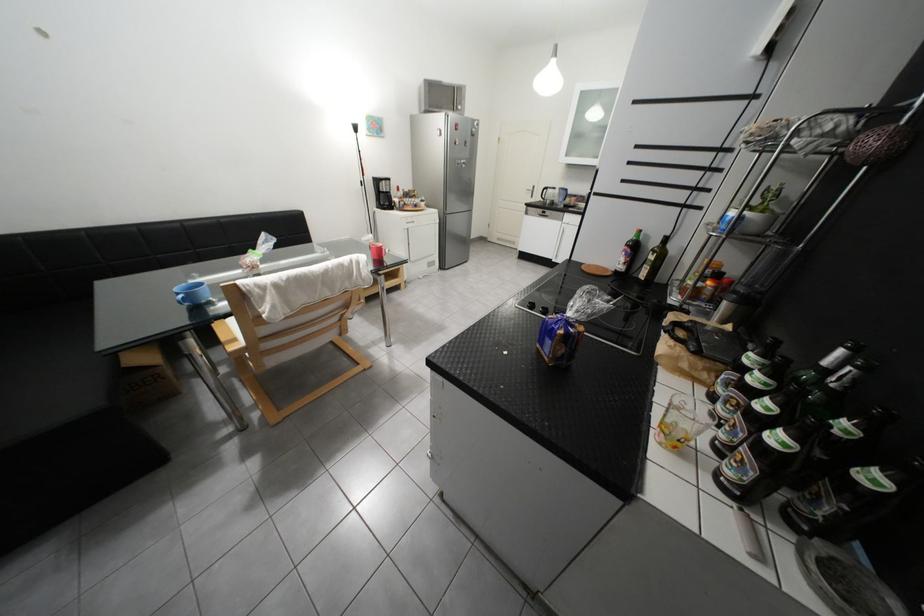
Where is `white door handle`? The height and width of the screenshot is (616, 924). white door handle is located at coordinates (530, 190).